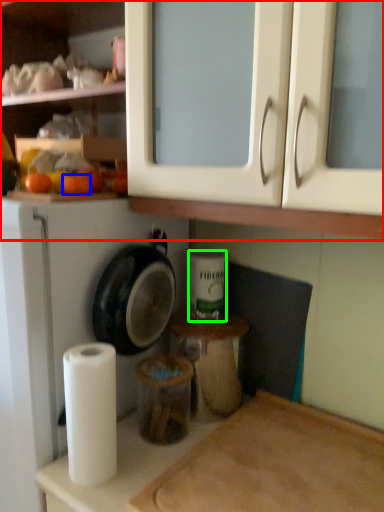
Question: Considering the real-world distances, which object is closest to cabinetry (highlighted by a red box)? orange (highlighted by a blue box) or toilet paper (highlighted by a green box).

Choices:
 (A) orange
 (B) toilet paper

Answer: (A)